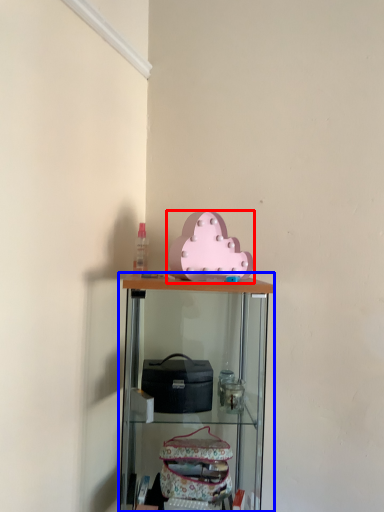
Question: Which object appears farthest to the camera in this image, toy (highlighted by a red box) or shelf (highlighted by a blue box)?

Choices:
 (A) toy
 (B) shelf

Answer: (A)